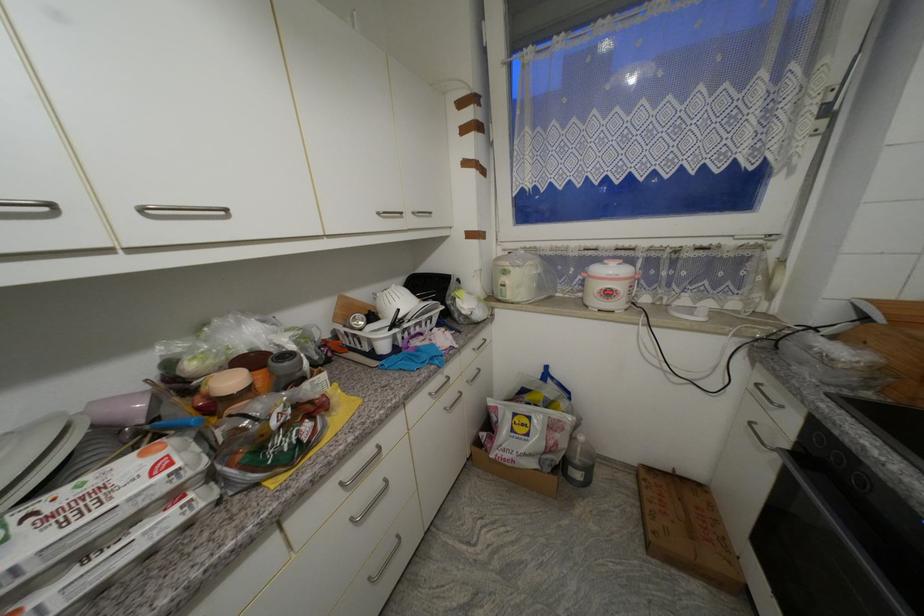
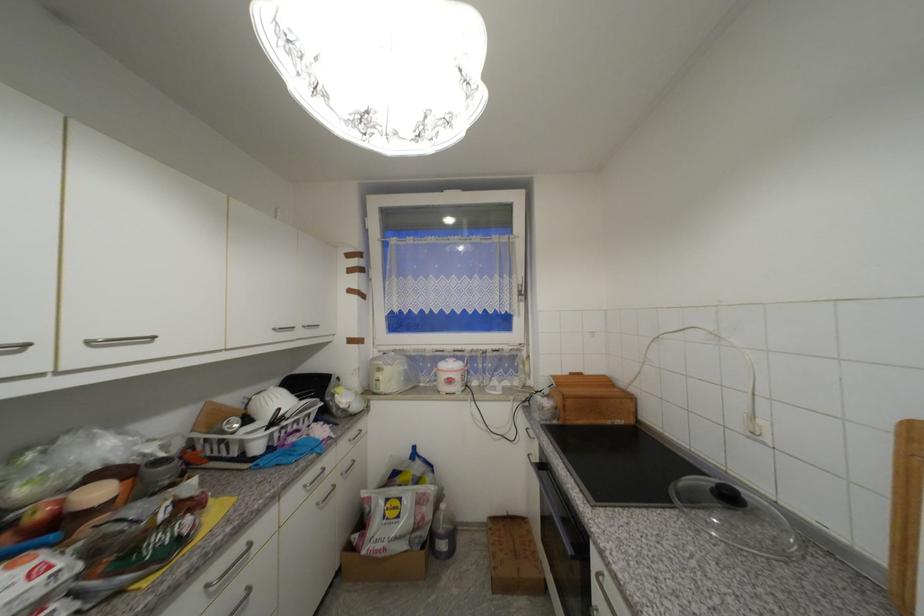
In the second image, find the point that corresponds to (614,294) in the first image.

(456, 382)